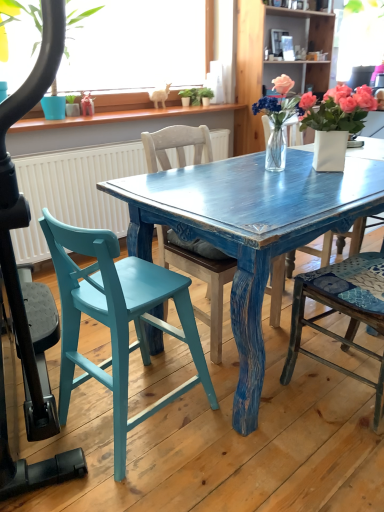
Question: Is wooden chair at center, arranged as the 2th chair when viewed from the right, in front of clear glass vase at center, the second houseplant in the right-to-left sequence?

Choices:
 (A) yes
 (B) no

Answer: (A)

Question: Considering the relative sizes of wooden chair at center, arranged as the 2th chair when viewed from the right, and clear glass vase at center, the second houseplant in the right-to-left sequence, in the image provided, is wooden chair at center, arranged as the 2th chair when viewed from the right, bigger than clear glass vase at center, the second houseplant in the right-to-left sequence,?

Choices:
 (A) no
 (B) yes

Answer: (B)

Question: Is wooden chair at center, arranged as the 2th chair when viewed from the right, oriented away from clear glass vase at center, the second houseplant from the left?

Choices:
 (A) no
 (B) yes

Answer: (A)

Question: Is clear glass vase at center, the second houseplant in the right-to-left sequence, a part of wooden chair at center, which appears as the second chair when viewed from the left?

Choices:
 (A) no
 (B) yes

Answer: (B)

Question: Are wooden chair at center, arranged as the 2th chair when viewed from the right, and clear glass vase at center, the second houseplant in the right-to-left sequence, making contact?

Choices:
 (A) yes
 (B) no

Answer: (B)

Question: From a real-world perspective, relative to white ceramic vase at upper right, the 3th houseplant from the left, is wooden chair at right, the 3th chair when ordered from left to right, vertically above or below?

Choices:
 (A) above
 (B) below

Answer: (B)

Question: In terms of height, does wooden chair at right, the 3th chair when ordered from left to right, look taller or shorter compared to white ceramic vase at upper right, the 3th houseplant from the left?

Choices:
 (A) short
 (B) tall

Answer: (B)

Question: Relative to white ceramic vase at upper right, the 3th houseplant from the left, is wooden chair at right, the 3th chair when ordered from left to right, in front or behind?

Choices:
 (A) front
 (B) behind

Answer: (A)

Question: Choose the correct answer: Is wooden chair at right, the 3th chair when ordered from left to right, inside white ceramic vase at upper right, the 3th houseplant from the left, or outside it?

Choices:
 (A) inside
 (B) outside

Answer: (B)

Question: Is wooden chair at right, placed as the first chair when sorted from right to left, spatially inside green matte plant at upper left, the third houseplant in the right-to-left sequence, or outside of it?

Choices:
 (A) outside
 (B) inside

Answer: (A)

Question: In terms of height, does wooden chair at right, placed as the first chair when sorted from right to left, look taller or shorter compared to green matte plant at upper left, the third houseplant in the right-to-left sequence?

Choices:
 (A) tall
 (B) short

Answer: (A)

Question: Looking at their shapes, would you say wooden chair at right, the 3th chair when ordered from left to right, is wider or thinner than green matte plant at upper left, the first houseplant from the left?

Choices:
 (A) thin
 (B) wide

Answer: (B)

Question: Looking at the image, does wooden chair at right, placed as the first chair when sorted from right to left, seem bigger or smaller compared to green matte plant at upper left, the third houseplant in the right-to-left sequence?

Choices:
 (A) big
 (B) small

Answer: (B)

Question: Relative to clear glass vase at center, the second houseplant from the left, is wooden chair at right, the 3th chair when ordered from left to right, in front or behind?

Choices:
 (A) behind
 (B) front

Answer: (B)

Question: Considering the positions of wooden chair at right, placed as the first chair when sorted from right to left, and clear glass vase at center, the second houseplant in the right-to-left sequence, in the image, is wooden chair at right, placed as the first chair when sorted from right to left, taller or shorter than clear glass vase at center, the second houseplant in the right-to-left sequence,?

Choices:
 (A) tall
 (B) short

Answer: (A)